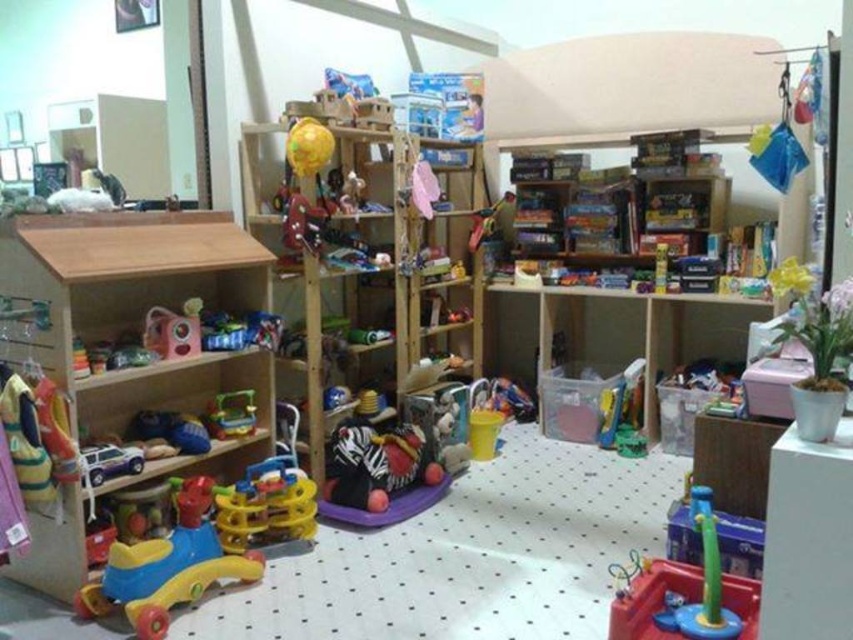
Is rubberized plastic walker at lower left below translucent plastic toy at lower right?

Correct, rubberized plastic walker at lower left is located below translucent plastic toy at lower right.

Does rubberized plastic walker at lower left have a lesser width compared to translucent plastic toy at lower right?

In fact, rubberized plastic walker at lower left might be wider than translucent plastic toy at lower right.

You are a GUI agent. You are given a task and a screenshot of the screen. Output one action in this format:
    pyautogui.click(x=<x>, y=<y>)
    Task: Click on the rubberized plastic walker at lower left
    The width and height of the screenshot is (853, 640).
    Given the screenshot: What is the action you would take?
    pyautogui.click(x=167, y=566)

Find the location of a particular element. The height and width of the screenshot is (640, 853). rubberized plastic walker at lower left is located at coordinates (167, 566).

Which of these two, rubberized plastic walker at lower left or rubber yellow and blue walker at lower left, stands taller?

With more height is rubberized plastic walker at lower left.

Can you confirm if rubberized plastic walker at lower left is positioned above rubber yellow and blue walker at lower left?

Actually, rubberized plastic walker at lower left is below rubber yellow and blue walker at lower left.

The width and height of the screenshot is (853, 640). I want to click on rubberized plastic walker at lower left, so click(x=167, y=566).

Find the location of `rubberized plastic walker at lower left`. rubberized plastic walker at lower left is located at coordinates (167, 566).

Is point (666, 595) positioned before point (178, 337)?

Yes.

Which of these two, translucent plastic toy at lower right or matte plastic toy at center, stands taller?

Standing taller between the two is translucent plastic toy at lower right.

Looking at this image, who is more forward, (631, 576) or (169, 355)?

Point (631, 576) is more forward.

Identify the location of translucent plastic toy at lower right. (686, 592).